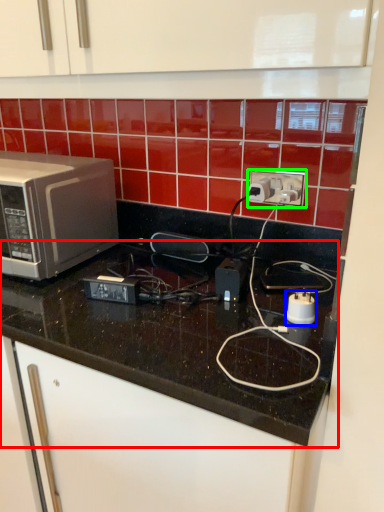
Question: Based on their relative distances, which object is farther from countertop (highlighted by a red box)? Choose from appliance (highlighted by a blue box) and power plugs and sockets (highlighted by a green box).

Choices:
 (A) appliance
 (B) power plugs and sockets

Answer: (B)